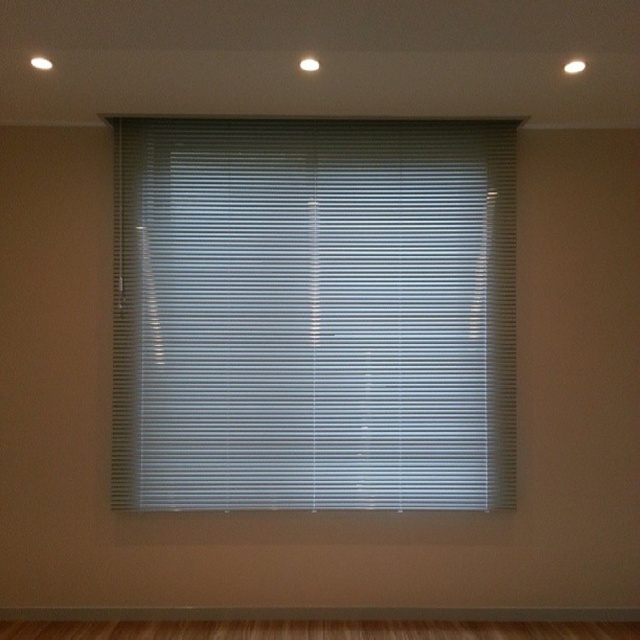
Looking at this image, does white matte blinds at center have a smaller size compared to brown wood flooring at bottom?

Actually, white matte blinds at center might be larger than brown wood flooring at bottom.

Which is below, white matte blinds at center or brown wood flooring at bottom?

brown wood flooring at bottom is lower down.

Locate an element on the screen. Image resolution: width=640 pixels, height=640 pixels. white matte blinds at center is located at coordinates tap(314, 314).

Identify the location of white matte blinds at center. (314, 314).